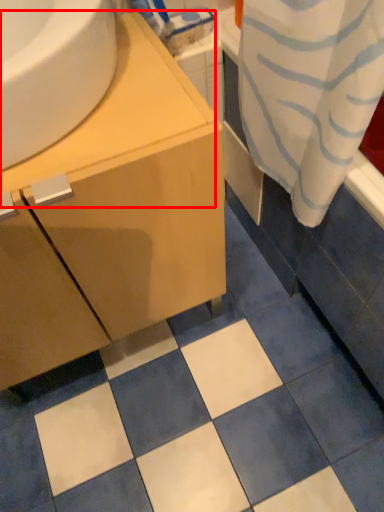
Question: From the image's perspective, where is counter top (annotated by the red box) located relative to bathroom cabinet?

Choices:
 (A) below
 (B) above

Answer: (B)